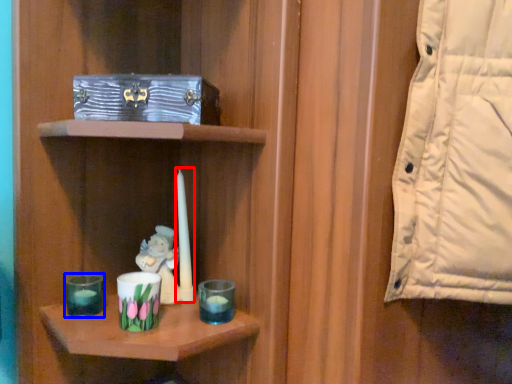
Question: Which of the following is the farthest to the observer, birthday candle (highlighted by a red box) or candle holder (highlighted by a blue box)?

Choices:
 (A) birthday candle
 (B) candle holder

Answer: (A)